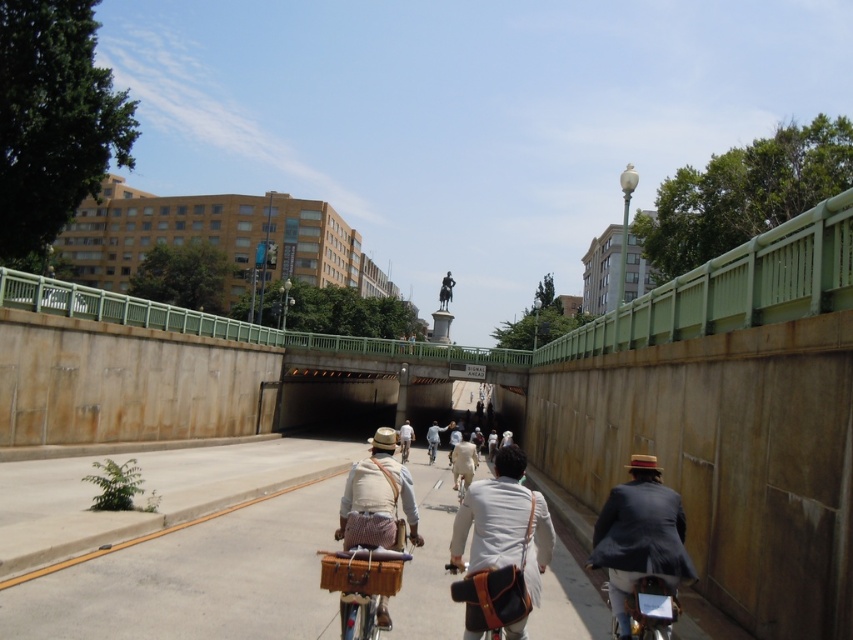
This screenshot has width=853, height=640. Describe the element at coordinates (639, 538) in the screenshot. I see `dark blue suit at right` at that location.

Who is more forward, (611, 520) or (427, 438)?

Positioned in front is point (611, 520).

Is point (660, 548) closer to viewer compared to point (434, 460)?

Yes, it is.

The height and width of the screenshot is (640, 853). I want to click on dark blue suit at right, so click(639, 538).

Can you confirm if white leather jacket at center is shorter than metallic silver bicycle at center?

In fact, white leather jacket at center may be taller than metallic silver bicycle at center.

Does white leather jacket at center have a greater width compared to metallic silver bicycle at center?

Correct, the width of white leather jacket at center exceeds that of metallic silver bicycle at center.

Image resolution: width=853 pixels, height=640 pixels. In order to click on white leather jacket at center in this screenshot , I will do `click(503, 524)`.

Who is positioned more to the left, white leather jacket at center or white cotton shirt at center?

white cotton shirt at center is more to the left.

What do you see at coordinates (503, 524) in the screenshot?
I see `white leather jacket at center` at bounding box center [503, 524].

Find the location of a particular element. The height and width of the screenshot is (640, 853). white leather jacket at center is located at coordinates (503, 524).